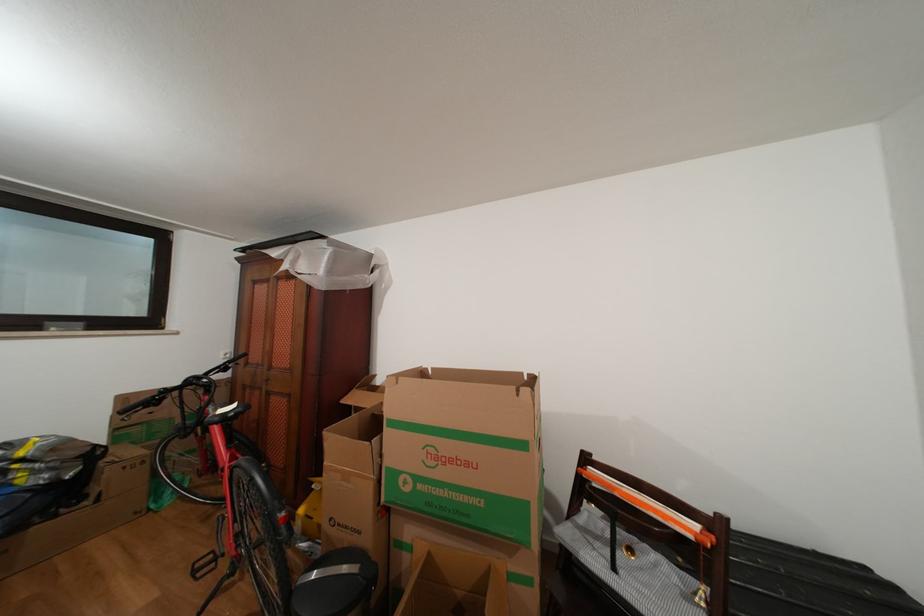
Identify the location of black handlebar grip. The height and width of the screenshot is (616, 924). click(141, 406).